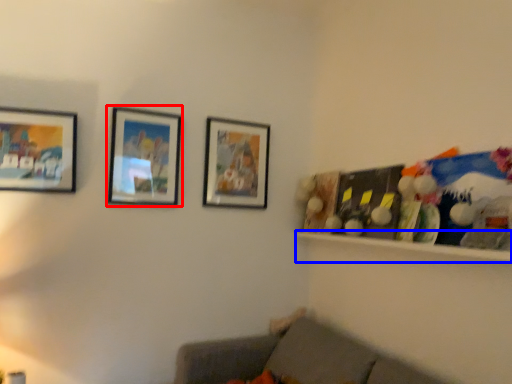
Question: Among these objects, which one is nearest to the camera, picture frame (highlighted by a red box) or shelf (highlighted by a blue box)?

Choices:
 (A) picture frame
 (B) shelf

Answer: (B)